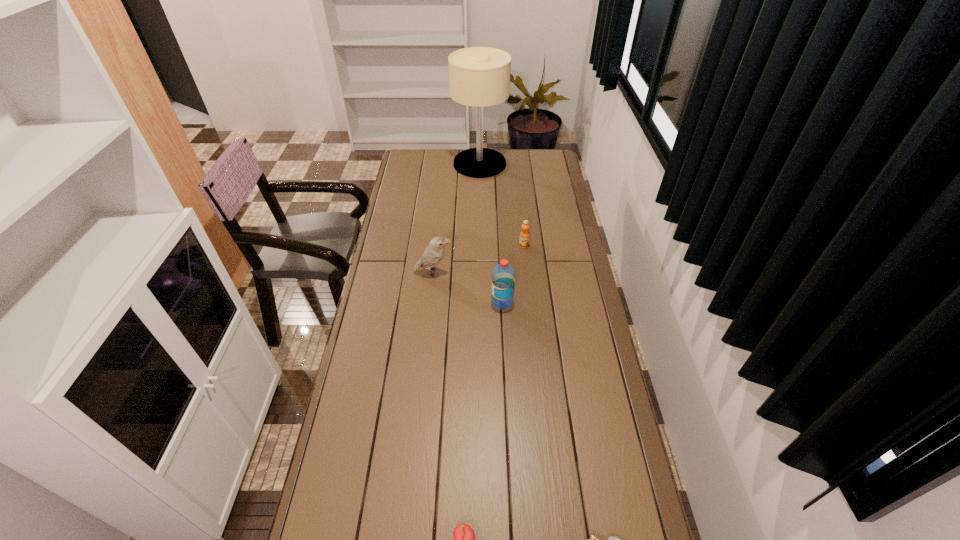
Locate an element on the screen. This screenshot has height=540, width=960. free space between the second object from right to left and the tallest object is located at coordinates (502, 205).

Identify which object is located as the fifth nearest to the orange juice. Please provide its 2D coordinates. Your answer should be formatted as a tuple, i.e. [(x, y)], where the tuple contains the x and y coordinates of a point satisfying the conditions above.

[(593, 539)]

In order to click on object that is the third closest to the farthest object in this screenshot , I will do point(503,275).

The image size is (960, 540). What are the coordinates of `free space that satisfies the following two spatial constraints: 1. on the front label of the fifth object from left to right; 2. at the face of the third farthest object` in the screenshot? It's located at (527, 272).

What are the coordinates of `vacant area in the image that satisfies the following two spatial constraints: 1. on the front label of the third shortest object; 2. at the face of the third farthest object` in the screenshot? It's located at (527, 272).

At what (x,y) coordinates should I click in order to perform the action: click on free space that satisfies the following two spatial constraints: 1. on the front label of the second farthest object; 2. at the face of the bird. Please return your answer as a coordinate pair (x, y). Looking at the image, I should click on (527, 272).

Where is `vacant position in the image that satisfies the following two spatial constraints: 1. on the front label of the second farthest object; 2. at the face of the bird`? This screenshot has width=960, height=540. vacant position in the image that satisfies the following two spatial constraints: 1. on the front label of the second farthest object; 2. at the face of the bird is located at coordinates (527, 272).